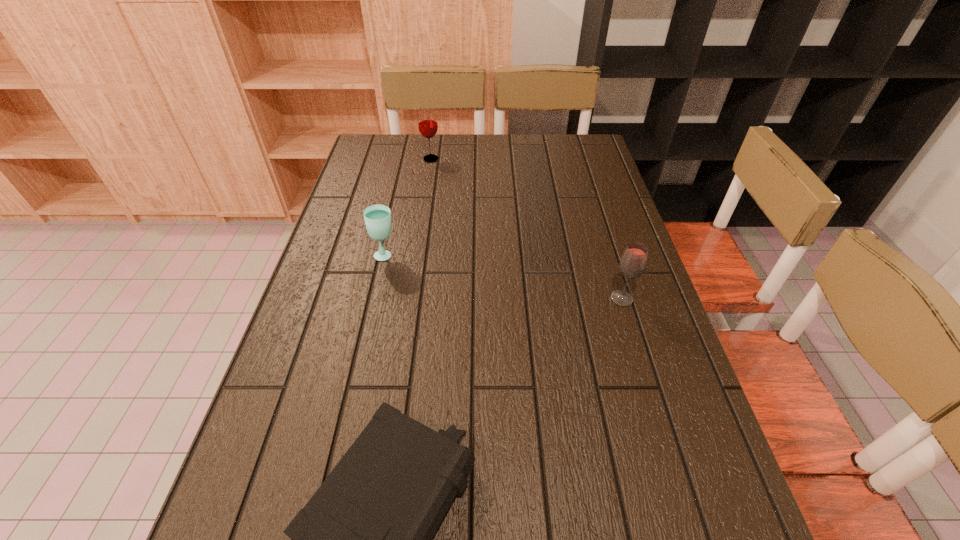
The height and width of the screenshot is (540, 960). In order to click on object positioned at the left edge in this screenshot , I will do `click(377, 217)`.

Identify the location of object that is at the right edge. This screenshot has width=960, height=540. (633, 262).

In the image, there is a desktop. At what (x,y) coordinates should I click in order to perform the action: click on vacant space at the far edge. Please return your answer as a coordinate pair (x, y). Looking at the image, I should click on (461, 134).

The width and height of the screenshot is (960, 540). I want to click on vacant space at the left edge of the desktop, so click(372, 298).

In the image, there is a desktop. Identify the location of vacant space at the right edge. [x=598, y=181].

This screenshot has height=540, width=960. Find the location of `free space at the far right corner of the desktop`. free space at the far right corner of the desktop is located at coordinates (576, 138).

You are a GUI agent. You are given a task and a screenshot of the screen. Output one action in this format:
    pyautogui.click(x=<x>, y=<y>)
    Task: Click on the unoccupied area between the second farthest object and the farthest object
    
    Given the screenshot: What is the action you would take?
    pyautogui.click(x=408, y=207)

You are a GUI agent. You are given a task and a screenshot of the screen. Output one action in this format:
    pyautogui.click(x=<x>, y=<y>)
    Task: Click on the vacant point located between the farthest object and the second nearest glass
    Image resolution: width=960 pixels, height=540 pixels.
    Given the screenshot: What is the action you would take?
    pyautogui.click(x=408, y=207)

The image size is (960, 540). In order to click on free space between the rightmost object and the second farthest glass in this screenshot , I will do `click(503, 276)`.

Where is `vacant space in between the farthest object and the leftmost glass`? Image resolution: width=960 pixels, height=540 pixels. vacant space in between the farthest object and the leftmost glass is located at coordinates (408, 207).